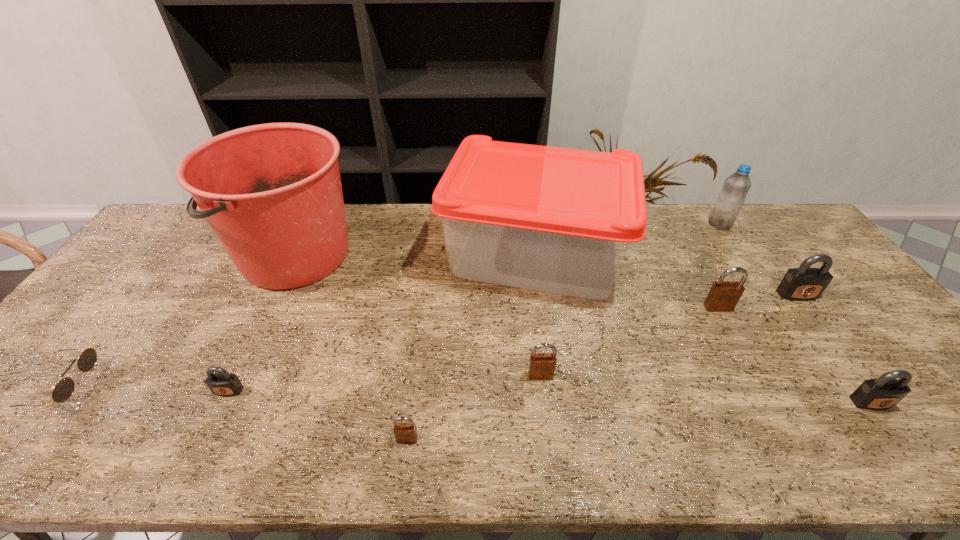
This screenshot has width=960, height=540. What are the coordinates of `the tallest object` in the screenshot? It's located at (272, 193).

Locate an element on the screen. bucket is located at coordinates (272, 193).

In order to click on red tray in this screenshot , I will do `click(559, 220)`.

Identify the location of the ninth shortest object. (559, 220).

I want to click on water bottle, so click(736, 187).

Where is `blue water bottle`? This screenshot has width=960, height=540. blue water bottle is located at coordinates (736, 187).

Where is `the biggest gray padlock`? the biggest gray padlock is located at coordinates (804, 283).

What are the coordinates of `the farthest gray padlock` in the screenshot? It's located at (804, 283).

You are a GUI agent. You are given a task and a screenshot of the screen. Output one action in this format:
    pyautogui.click(x=<x>, y=<y>)
    Task: Click on the fourth padlock from left to right
    The image size is (960, 540).
    Given the screenshot: What is the action you would take?
    pyautogui.click(x=723, y=296)

Locate an element on the screen. This screenshot has width=960, height=540. the farthest brown padlock is located at coordinates (723, 296).